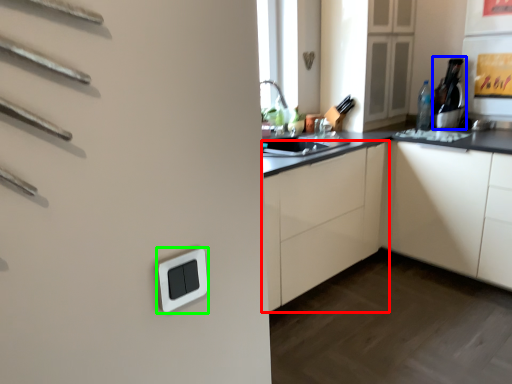
Question: Which object is positioned closest to cabinetry (highlighted by a red box)? Select from appliance (highlighted by a blue box) and light switch (highlighted by a green box).

Choices:
 (A) appliance
 (B) light switch

Answer: (A)